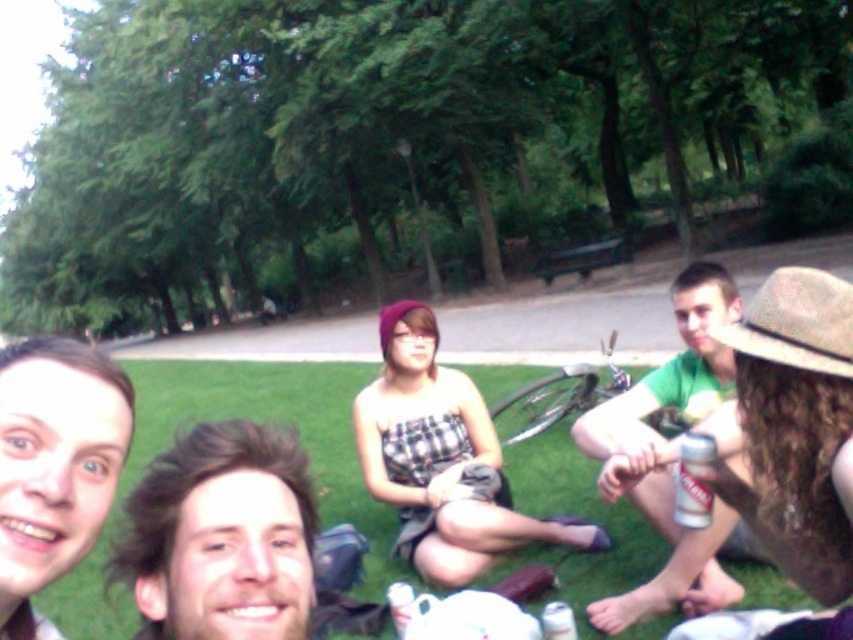
Question: Observing the image, what is the correct spatial positioning of green grass at lower center in reference to silver metallic can at lower right?

Choices:
 (A) right
 (B) left

Answer: (B)

Question: Which point appears farthest from the camera in this image?

Choices:
 (A) (409, 577)
 (B) (675, 449)
 (C) (705, 468)

Answer: (A)

Question: Which point is farther to the camera?

Choices:
 (A) green matte shirt at center
 (B) green grass at lower center
 (C) silver metallic can at lower right

Answer: (A)

Question: Is green matte shirt at center smaller than silver metallic can at lower right?

Choices:
 (A) no
 (B) yes

Answer: (A)

Question: Is green matte shirt at center above silver metallic can at lower right?

Choices:
 (A) yes
 (B) no

Answer: (B)

Question: Which of these objects is positioned farthest from the green matte shirt at center?

Choices:
 (A) green grass at lower center
 (B) silver metallic can at lower right

Answer: (A)